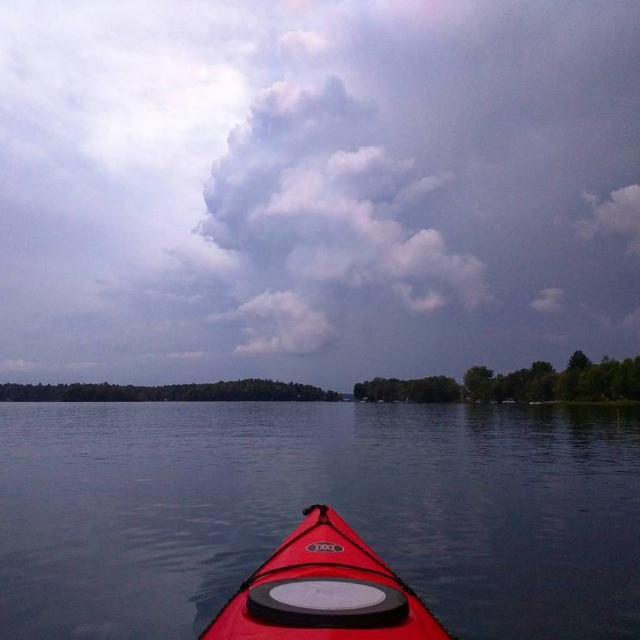
Question: Which point is closer to the camera?

Choices:
 (A) transparent water at center
 (B) cloudy sky at upper center
 (C) matte red kayak at center

Answer: (C)

Question: Which object is positioned closest to the matte red kayak at center?

Choices:
 (A) transparent water at center
 (B) cloudy sky at upper center

Answer: (A)

Question: Is cloudy sky at upper center closer to camera compared to matte red kayak at center?

Choices:
 (A) no
 (B) yes

Answer: (A)

Question: Is the position of cloudy sky at upper center more distant than that of transparent water at center?

Choices:
 (A) no
 (B) yes

Answer: (B)

Question: Which point is farther from the camera taking this photo?

Choices:
 (A) (106, 556)
 (B) (333, 552)

Answer: (A)

Question: Is cloudy sky at upper center closer to the viewer compared to matte red kayak at center?

Choices:
 (A) no
 (B) yes

Answer: (A)